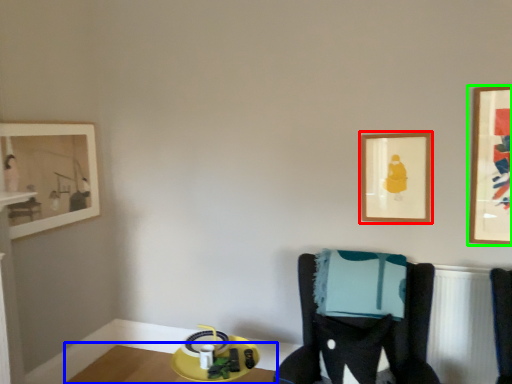
Question: Based on their relative distances, which object is farther from picture frame (highlighted by a red box)? Choose from table (highlighted by a blue box) and picture frame (highlighted by a green box).

Choices:
 (A) table
 (B) picture frame

Answer: (A)